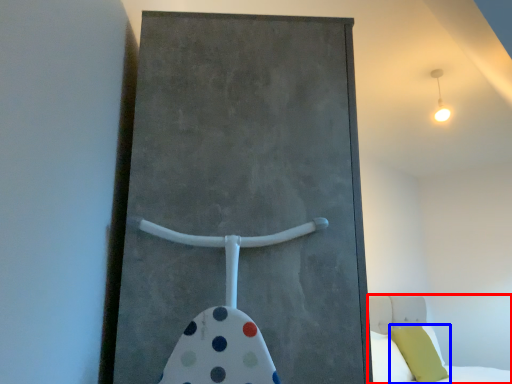
Question: Which point is closer to the camera, bed (highlighted by a red box) or pillow (highlighted by a blue box)?

Choices:
 (A) bed
 (B) pillow

Answer: (A)